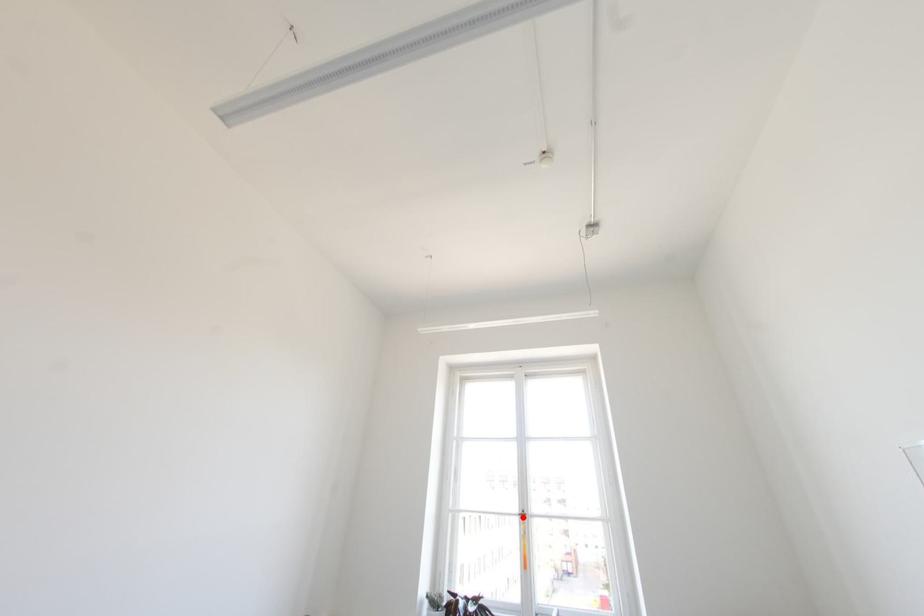
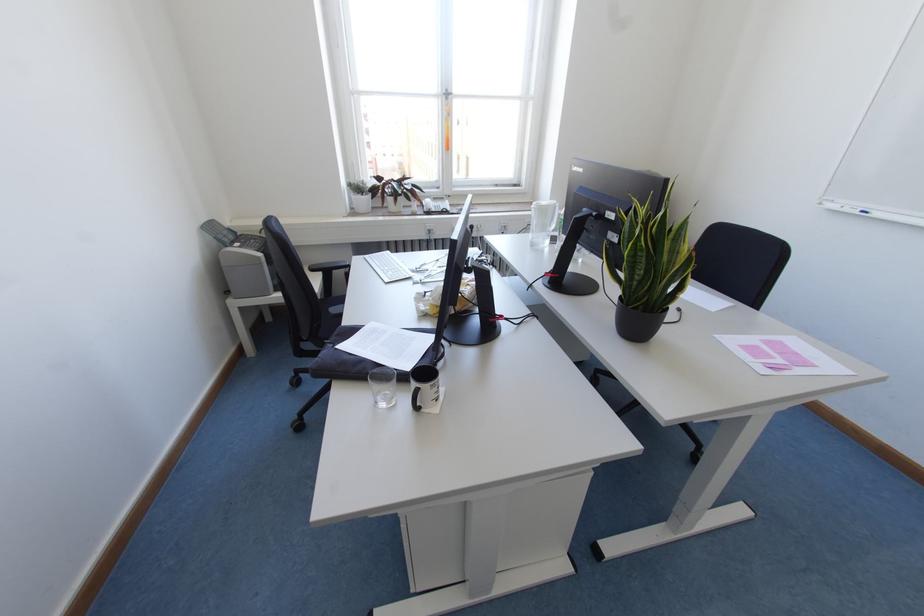
Question: I am providing you with two images of the same scene from different viewpoints. In image1, a red point is highlighted. Considering the same 3D point in image2, which of the following is correct?

Choices:
 (A) It is closer
 (B) It is farther

Answer: (A)